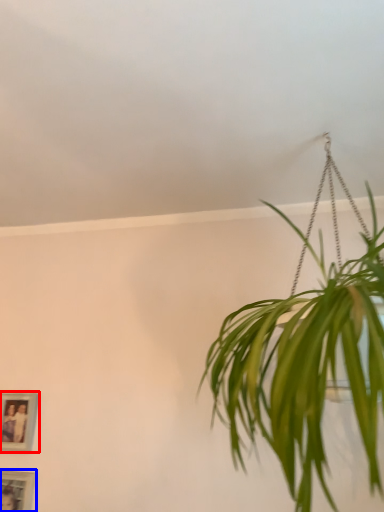
Question: Which object is further to the camera taking this photo, picture frame (highlighted by a red box) or picture frame (highlighted by a blue box)?

Choices:
 (A) picture frame
 (B) picture frame

Answer: (A)